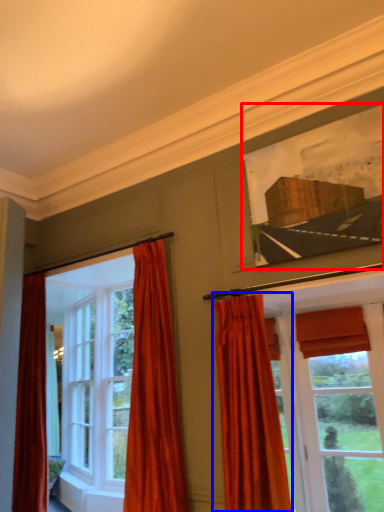
Question: Among these objects, which one is farthest to the camera, picture frame (highlighted by a red box) or curtain (highlighted by a blue box)?

Choices:
 (A) picture frame
 (B) curtain

Answer: (A)